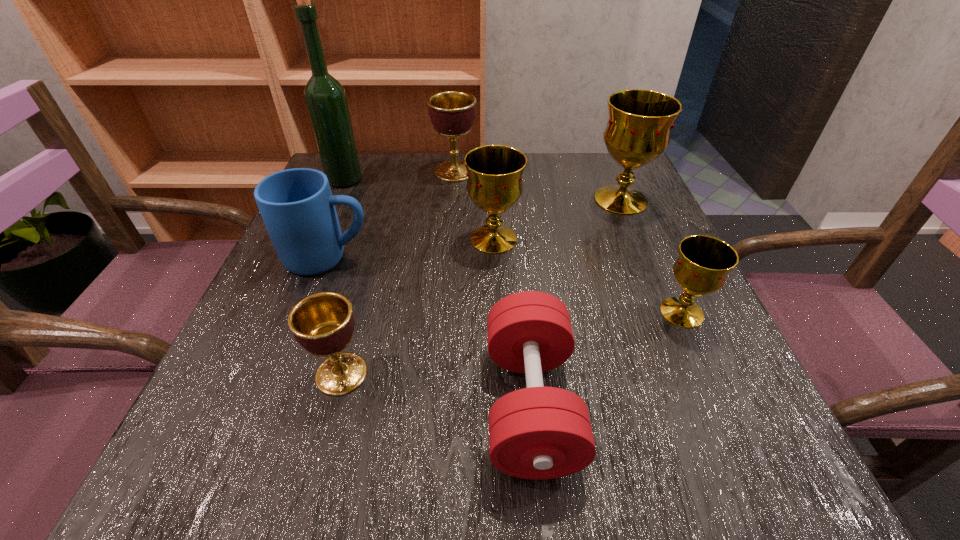
The width and height of the screenshot is (960, 540). Identify the location of vacant space located on the right of the nearest chalice. (416, 374).

Where is `free region located 0.380m on the left of the dumbbell`? The image size is (960, 540). free region located 0.380m on the left of the dumbbell is located at coordinates (220, 404).

Find the location of a particular element. The image size is (960, 540). liquor positioned at the far edge is located at coordinates (325, 97).

You are a GUI agent. You are given a task and a screenshot of the screen. Output one action in this format:
    pyautogui.click(x=<x>, y=<y>)
    Task: Click on the object at the near edge
    
    Given the screenshot: What is the action you would take?
    pyautogui.click(x=537, y=433)

The height and width of the screenshot is (540, 960). Find the location of `liquor that is at the left edge`. liquor that is at the left edge is located at coordinates (325, 97).

Image resolution: width=960 pixels, height=540 pixels. What are the coordinates of `mug positioned at the left edge` in the screenshot? It's located at (297, 207).

Identify the location of chalice at the left edge. This screenshot has width=960, height=540. (322, 323).

Image resolution: width=960 pixels, height=540 pixels. I want to click on object positioned at the far left corner, so click(325, 97).

Identify the location of object that is positioned at the far right corner. (638, 130).

In the image, there is a desktop. Identify the location of vacant space at the far edge. Image resolution: width=960 pixels, height=540 pixels. (420, 170).